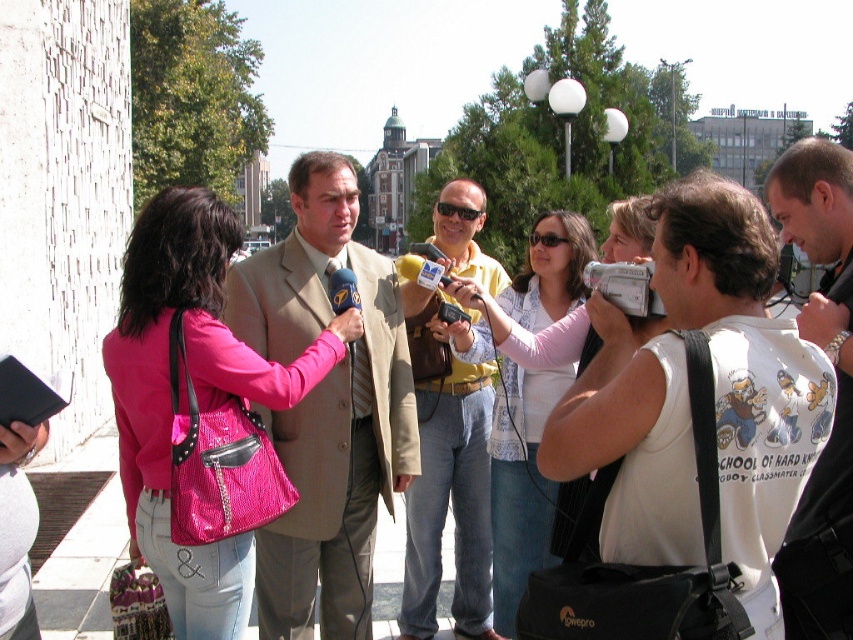
Who is positioned more to the right, white cotton tank top at center or yellowmaterialshirt at center?

white cotton tank top at center is more to the right.

Does white cotton tank top at center appear over yellowmaterialshirt at center?

No, white cotton tank top at center is not above yellowmaterialshirt at center.

Which is in front, point (544, 452) or point (465, 182)?

Point (544, 452) is in front.

The width and height of the screenshot is (853, 640). In order to click on white cotton tank top at center in this screenshot , I will do `click(744, 371)`.

Where is `pink snakeskin purse at center`? The height and width of the screenshot is (640, 853). pink snakeskin purse at center is located at coordinates (194, 403).

Does pink snakeskin purse at center appear under white printed t-shirt at center?

Yes, pink snakeskin purse at center is below white printed t-shirt at center.

In order to click on pink snakeskin purse at center in this screenshot , I will do `click(194, 403)`.

Looking at this image, which is above, pink snakeskin purse at center or light pink fabric shirt at center?

light pink fabric shirt at center is higher up.

The width and height of the screenshot is (853, 640). Describe the element at coordinates (194, 403) in the screenshot. I see `pink snakeskin purse at center` at that location.

Find the location of `pink snakeskin purse at center`. pink snakeskin purse at center is located at coordinates (194, 403).